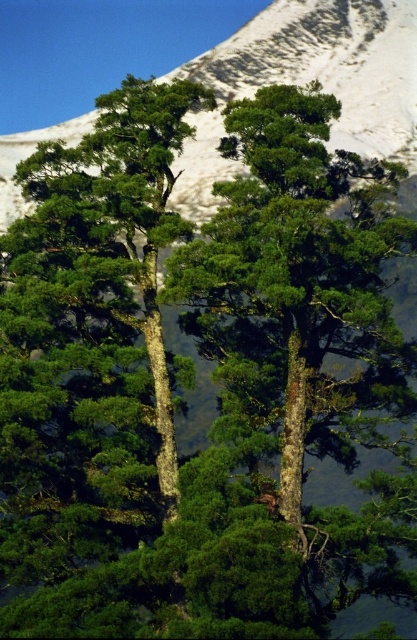
You are standing in front of the two trees in the scene. There are two points marked on the trees, one at coordinate point (324,397) and the other at point (268,24). Which point is nearer to your eyes?

Point (324,397) is closer to the camera than point (268,24), so the point at (324,397) is nearer to your eyes.

You are an environmental scientist assessing the ecological impact of a new hiking trail. You need to determine if the green rough bark tree at center and the snowy white mountain at upper center can both be preserved without compromising the trail route. Based on their spatial relationship, is there enough space to design the trail around both?

The green rough bark tree at center occupies less space than the snowy white mountain at upper center. Since the tree takes up less area, it should be possible to design the trail route around both the green rough bark tree at center and the snowy white mountain at upper center without damaging either.